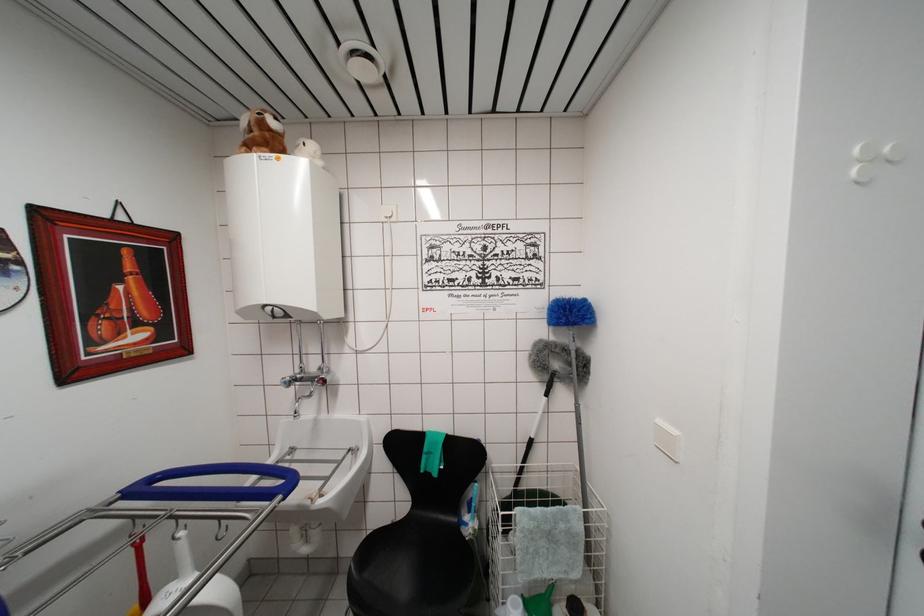
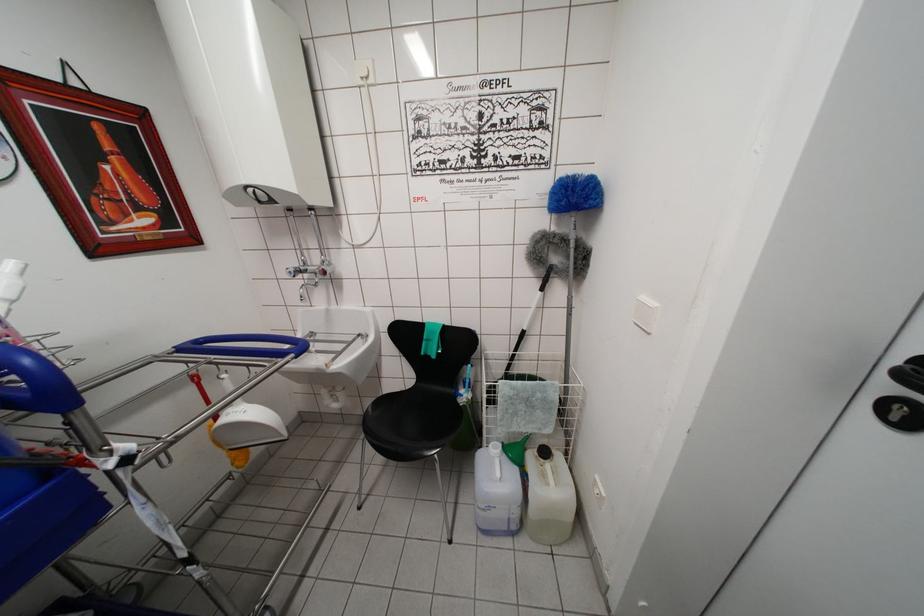
Locate, in the second image, the point that corresponds to (287,387) in the first image.

(293, 277)